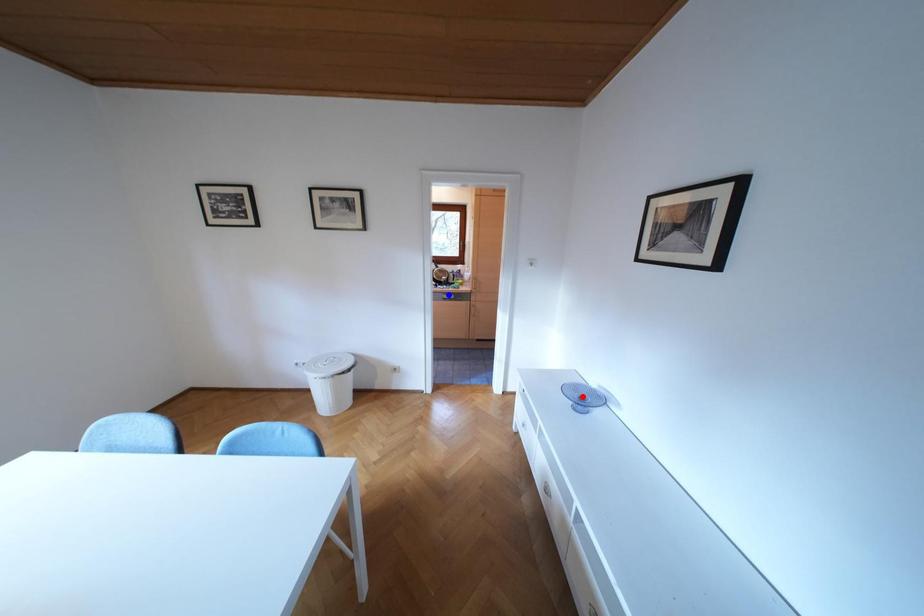
Question: Which of the two points in the image is closer to the camera?

Choices:
 (A) Blue point is closer.
 (B) Red point is closer.

Answer: (B)